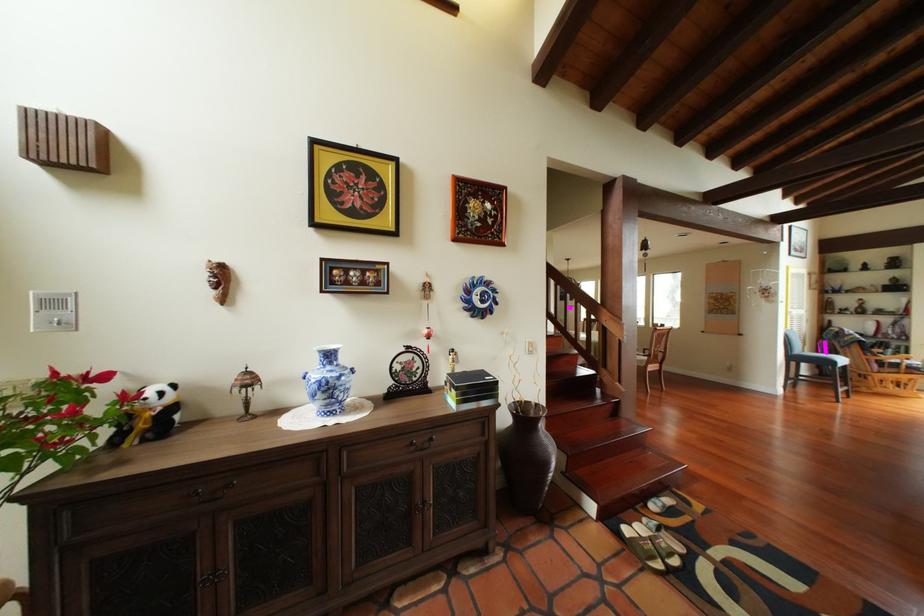
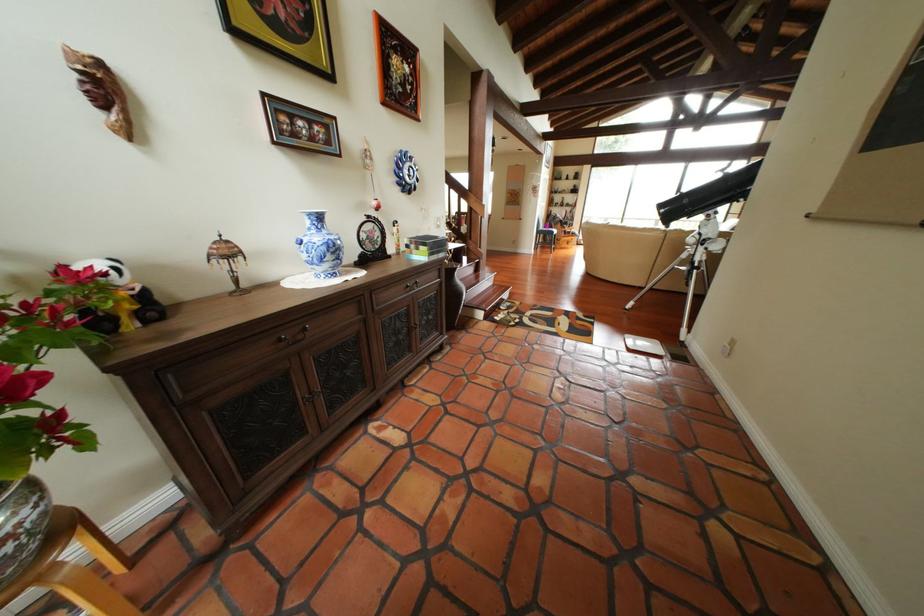
The point at (333, 397) is marked in the first image. Where is the corresponding point in the second image?

(342, 257)